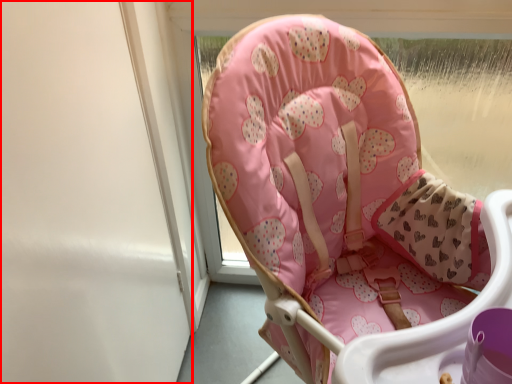
Question: Considering the relative positions of screen door (annotated by the red box) and chair in the image provided, where is screen door (annotated by the red box) located with respect to the staircase?

Choices:
 (A) right
 (B) left

Answer: (B)